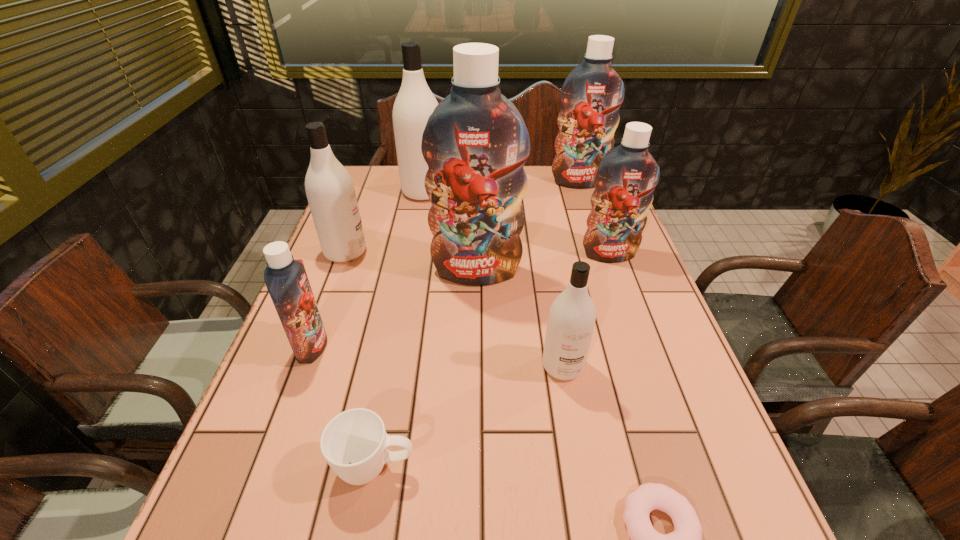
This screenshot has width=960, height=540. What are the coordinates of `vacant space located with the handle on the side of the eighth tallest object` in the screenshot? It's located at [624, 467].

The height and width of the screenshot is (540, 960). I want to click on object that is at the far right corner, so [591, 96].

Where is `free spot at the far edge of the desktop`? free spot at the far edge of the desktop is located at coordinates (544, 193).

In the image, there is a desktop. Identify the location of vacant space at the left edge. (326, 303).

This screenshot has width=960, height=540. Identify the location of vacant space at the right edge. (628, 285).

Locate an element on the screen. The width and height of the screenshot is (960, 540). free space at the far left corner of the desktop is located at coordinates (365, 174).

Where is `vacant region at the far right corner of the desktop`? The width and height of the screenshot is (960, 540). vacant region at the far right corner of the desktop is located at coordinates (581, 190).

You are a GUI agent. You are given a task and a screenshot of the screen. Output one action in this format:
    pyautogui.click(x=<x>, y=<y>)
    Task: Click on the blank region between the cup and the leftmost blue shampoo
    
    Given the screenshot: What is the action you would take?
    pyautogui.click(x=344, y=407)

The width and height of the screenshot is (960, 540). Identify the location of free space between the third shampoo from right to left and the second biggest blue shampoo. (570, 274).

The height and width of the screenshot is (540, 960). Identify the location of vacant space that's between the smallest blue shampoo and the sixth object from left to right. (438, 356).